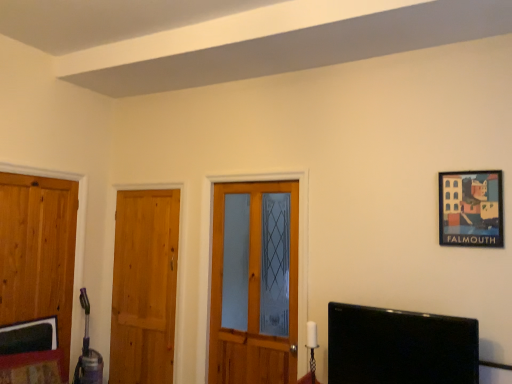
Question: Is wooden door at left, which is the 2th door from right to left, facing towards wooden door at left, the first door from the left?

Choices:
 (A) no
 (B) yes

Answer: (B)

Question: Considering the relative sizes of wooden door at left, which is the 2th door from right to left, and wooden door at left, the first door from the left, in the image provided, is wooden door at left, which is the 2th door from right to left, thinner than wooden door at left, the first door from the left,?

Choices:
 (A) yes
 (B) no

Answer: (A)

Question: Is wooden door at left, which is the 2th door from right to left, oriented away from wooden door at left, the third door positioned from the right?

Choices:
 (A) yes
 (B) no

Answer: (B)

Question: From a real-world perspective, does wooden door at left, which is the 2th door from right to left, stand above wooden door at left, the first door from the left?

Choices:
 (A) yes
 (B) no

Answer: (B)

Question: From the image's perspective, is wooden door at left, which is the 2th door from right to left, located beneath wooden door at left, the first door from the left?

Choices:
 (A) no
 (B) yes

Answer: (B)

Question: Considering the positions of wooden door at left, the third door positioned from the right, and wooden door at center, the 1th door viewed from the right, in the image, is wooden door at left, the third door positioned from the right, wider or thinner than wooden door at center, the 1th door viewed from the right,?

Choices:
 (A) wide
 (B) thin

Answer: (B)

Question: Considering the positions of wooden door at left, the first door from the left, and wooden door at center, the 1th door viewed from the right, in the image, is wooden door at left, the first door from the left, bigger or smaller than wooden door at center, the 1th door viewed from the right,?

Choices:
 (A) small
 (B) big

Answer: (A)

Question: From a real-world perspective, relative to wooden door at center, the 1th door viewed from the right, is wooden door at left, the third door positioned from the right, vertically above or below?

Choices:
 (A) above
 (B) below

Answer: (B)

Question: Do you think wooden door at left, the third door positioned from the right, is within wooden door at center, the 1th door viewed from the right, or outside of it?

Choices:
 (A) outside
 (B) inside

Answer: (A)

Question: From a real-world perspective, is wooden framed picture at upper right positioned above or below wooden door at left, the third door positioned from the right?

Choices:
 (A) below
 (B) above

Answer: (B)

Question: From the image's perspective, relative to wooden door at left, the third door positioned from the right, is wooden framed picture at upper right above or below?

Choices:
 (A) above
 (B) below

Answer: (A)

Question: Is point (479, 188) closer or farther from the camera than point (52, 263)?

Choices:
 (A) farther
 (B) closer

Answer: (B)

Question: From their relative heights in the image, would you say wooden framed picture at upper right is taller or shorter than wooden door at left, the first door from the left?

Choices:
 (A) short
 (B) tall

Answer: (A)

Question: Is wooden door at left, the first door from the left, wider or thinner than black glossy tv at lower right?

Choices:
 (A) thin
 (B) wide

Answer: (A)

Question: From their relative heights in the image, would you say wooden door at left, the third door positioned from the right, is taller or shorter than black glossy tv at lower right?

Choices:
 (A) tall
 (B) short

Answer: (A)